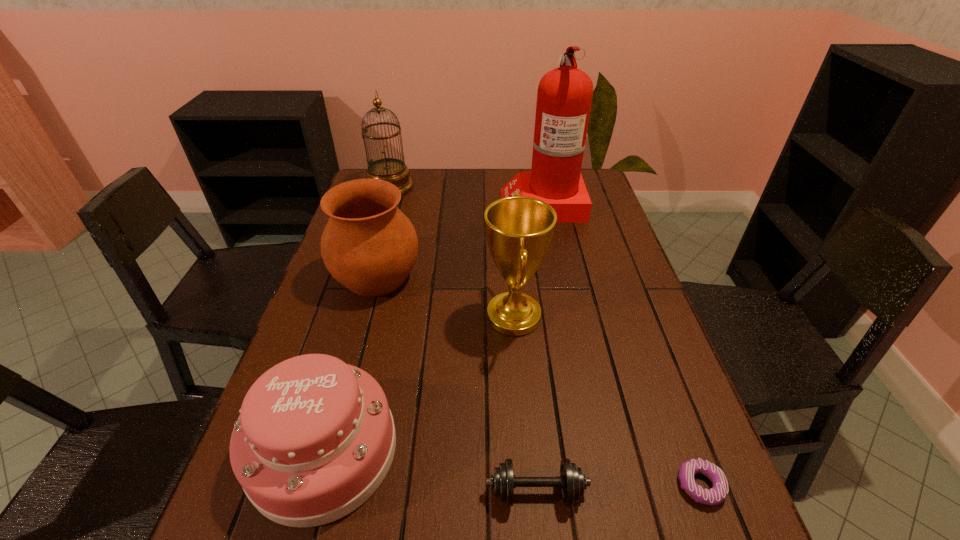
Image resolution: width=960 pixels, height=540 pixels. Identify the location of fire extinguisher. (564, 97).

At what (x,y) coordinates should I click in order to perform the action: click on birdcage. Please return your answer as a coordinate pair (x, y). Image resolution: width=960 pixels, height=540 pixels. Looking at the image, I should click on (393, 170).

Locate an element on the screen. The width and height of the screenshot is (960, 540). award is located at coordinates (519, 229).

This screenshot has height=540, width=960. In order to click on pottery in this screenshot , I will do `click(369, 245)`.

Where is `cake`? cake is located at coordinates (315, 438).

Where is `the second shortest object`? The width and height of the screenshot is (960, 540). the second shortest object is located at coordinates (572, 481).

This screenshot has width=960, height=540. Find the location of `doughnut`. doughnut is located at coordinates (718, 493).

Identify the location of the shortest object. The width and height of the screenshot is (960, 540). (718, 493).

Where is `vacant space located 0.100m on the front-facing side of the fire extinguisher`? The height and width of the screenshot is (540, 960). vacant space located 0.100m on the front-facing side of the fire extinguisher is located at coordinates (473, 202).

Identify the location of vacant space located 0.250m on the front-facing side of the fire extinguisher. (429, 202).